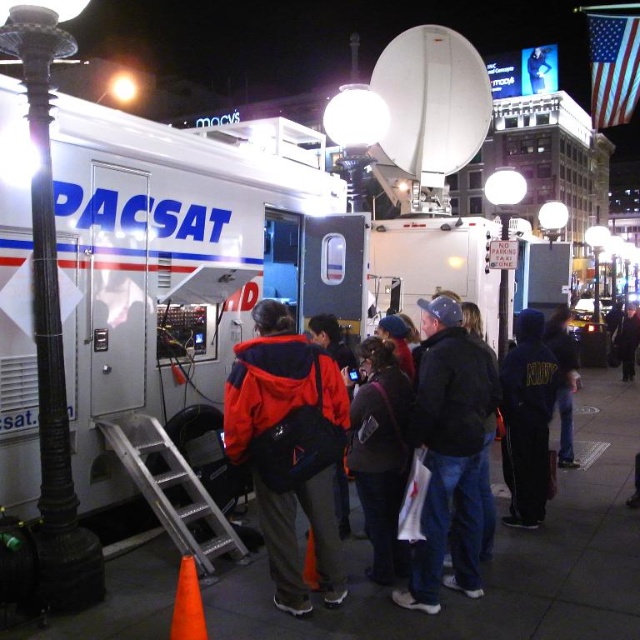
You are standing in front of the PACSAT satellite truck and need to reach a point near the satellite dish on the roof. You have two options to climb up the ladder attached to the truck. One path leads to point A at coordinates point A is point (253, 429) and the other to point B at coordinates point B is point (476, 588). Which point is closer to the camera, making it easier to access from your current position?

Point A at coordinates point A is point (253, 429) is closer to the camera than point B at coordinates point B is point (476, 588), so it would be easier to access from your current position.

You are a photographer standing in front of the PACSAT satellite truck. You notice two jackets in the scene, the dark blue jacket at center and the black leather jacket at center. Which jacket appears taller in the image?

The dark blue jacket at center is taller than the black leather jacket at center in the image.